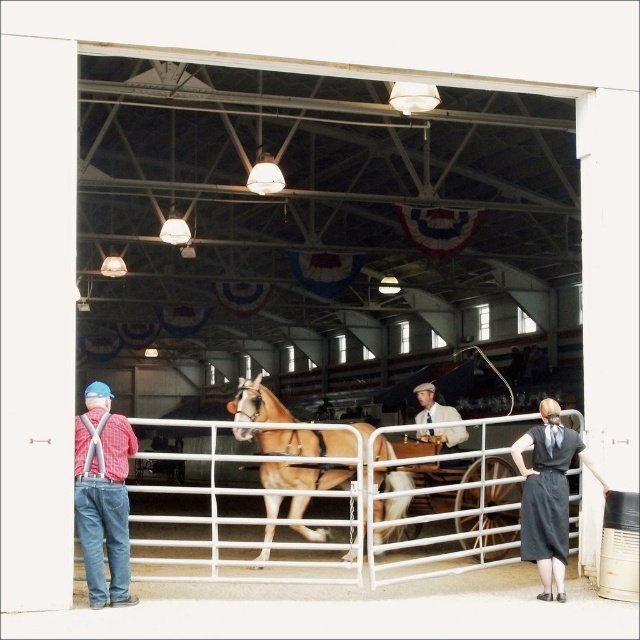
You are organizing an event in the barn and need to ensure that the light brown leather horse at center and the light brown leather jacket at center can both be displayed. Given that the display area is limited, which item should you prioritize placing first to accommodate their sizes?

The light brown leather horse at center should be prioritized since it has a larger size compared to the light brown leather jacket at center, requiring more space for proper display.

You are a guest at the event and want to take a photo of the white metal fence at center and the dark gray fabric dress at lower right. Which object should you focus on first if you want to capture both in a single frame without moving the camera?

The white metal fence at center is larger in size than the dark gray fabric dress at lower right, so you should focus on the white metal fence at center first to ensure it fills the frame appropriately before adjusting for the smaller dark gray fabric dress at lower right.

You are standing in the barn and want to find the light brown leather horse at center. According to the coordinates provided, where should you look in the image?

The light brown leather horse at center is located at the coordinates point (300, 442).